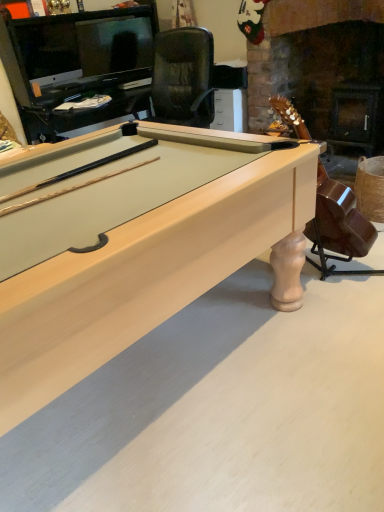
Question: From a real-world perspective, is light wood billiard table at center beneath matte brown guitar at center-right?

Choices:
 (A) yes
 (B) no

Answer: (A)

Question: Is the surface of light wood billiard table at center in direct contact with matte brown guitar at center-right?

Choices:
 (A) yes
 (B) no

Answer: (B)

Question: Does light wood billiard table at center appear on the right side of matte brown guitar at center-right?

Choices:
 (A) yes
 (B) no

Answer: (B)

Question: From the image's perspective, is light wood billiard table at center over matte brown guitar at center-right?

Choices:
 (A) no
 (B) yes

Answer: (A)

Question: Can you confirm if light wood billiard table at center is thinner than matte brown guitar at center-right?

Choices:
 (A) yes
 (B) no

Answer: (B)

Question: Is matte brown guitar at center-right completely or partially inside light wood billiard table at center?

Choices:
 (A) yes
 (B) no

Answer: (B)

Question: From the image's perspective, does matte brown guitar at center-right appear higher than light wood billiard table at center?

Choices:
 (A) no
 (B) yes

Answer: (B)

Question: Is matte brown guitar at center-right placed right next to light wood billiard table at center?

Choices:
 (A) no
 (B) yes

Answer: (A)

Question: Can you confirm if matte brown guitar at center-right is thinner than light wood billiard table at center?

Choices:
 (A) no
 (B) yes

Answer: (B)

Question: From the image's perspective, would you say matte brown guitar at center-right is shown under light wood billiard table at center?

Choices:
 (A) no
 (B) yes

Answer: (A)

Question: Considering the relative sizes of matte brown guitar at center-right and light wood billiard table at center in the image provided, is matte brown guitar at center-right taller than light wood billiard table at center?

Choices:
 (A) no
 (B) yes

Answer: (B)

Question: Is matte brown guitar at center-right smaller than light wood billiard table at center?

Choices:
 (A) no
 (B) yes

Answer: (B)

Question: From the image's perspective, is matte brown guitar at center-right above or below light wood billiard table at center?

Choices:
 (A) below
 (B) above

Answer: (B)